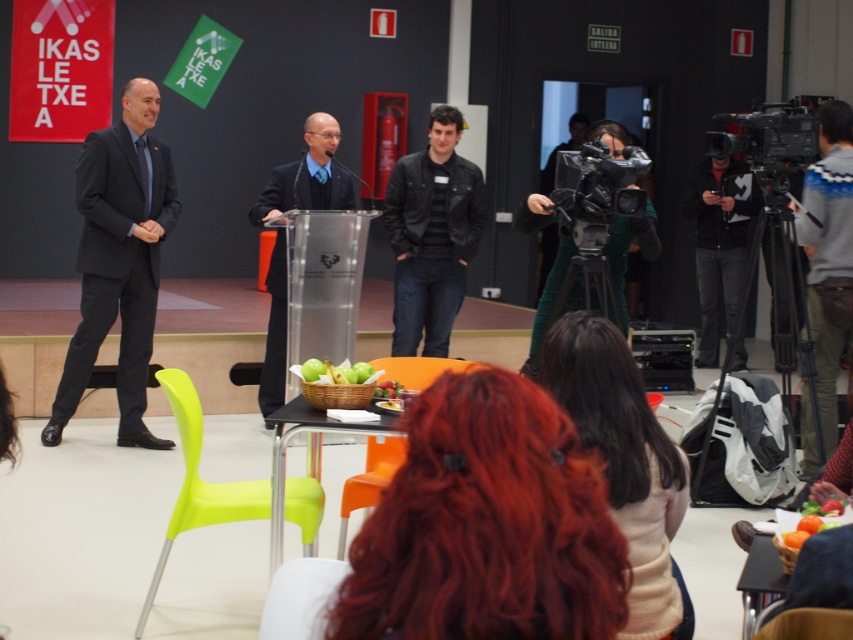
Is point (479, 189) positioned after point (277, 260)?

No.

Is point (462, 276) closer to viewer compared to point (289, 172)?

Yes, it is.

This screenshot has height=640, width=853. In order to click on black leather jacket at center in this screenshot , I will do `click(432, 234)`.

Locate an element on the screen. The height and width of the screenshot is (640, 853). black leather jacket at center is located at coordinates (432, 234).

Is orange plastic chair at center below wooden chair at lower right?

Yes.

Can you confirm if orange plastic chair at center is shorter than wooden chair at lower right?

No.

Does point (370, 467) come farther from viewer compared to point (844, 620)?

Yes, it is behind point (844, 620).

The width and height of the screenshot is (853, 640). Find the location of `orange plastic chair at center`. orange plastic chair at center is located at coordinates (369, 481).

The width and height of the screenshot is (853, 640). What are the coordinates of `dark gray jacket at center` in the screenshot? It's located at (721, 252).

Does dark gray jacket at center have a lesser height compared to green plastic chair at lower left?

No.

The height and width of the screenshot is (640, 853). In order to click on dark gray jacket at center in this screenshot , I will do `click(721, 252)`.